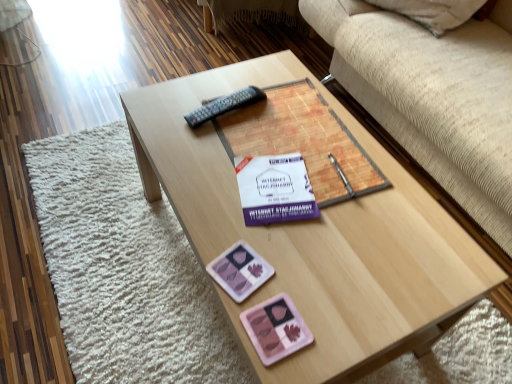
Where is `vacant area that lies between black plastic remote at center and white paper at center`? The image size is (512, 384). vacant area that lies between black plastic remote at center and white paper at center is located at coordinates (244, 148).